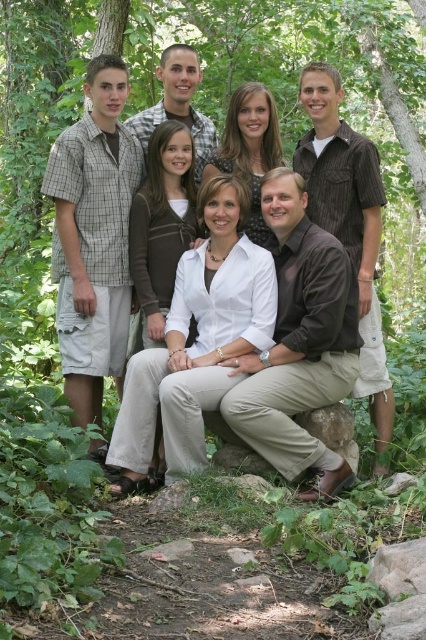
Question: Among these points, which one is farthest from the camera?

Choices:
 (A) (233, 93)
 (B) (322, 426)

Answer: (A)

Question: Considering the relative positions of matte white shirt at center and brown rough stone at lower center in the image provided, where is matte white shirt at center located with respect to brown rough stone at lower center?

Choices:
 (A) left
 (B) right

Answer: (B)

Question: Is matte white shirt at center in front of brown rough stone at lower center?

Choices:
 (A) no
 (B) yes

Answer: (A)

Question: Does matte white shirt at center have a smaller size compared to brown rough stone at lower center?

Choices:
 (A) yes
 (B) no

Answer: (B)